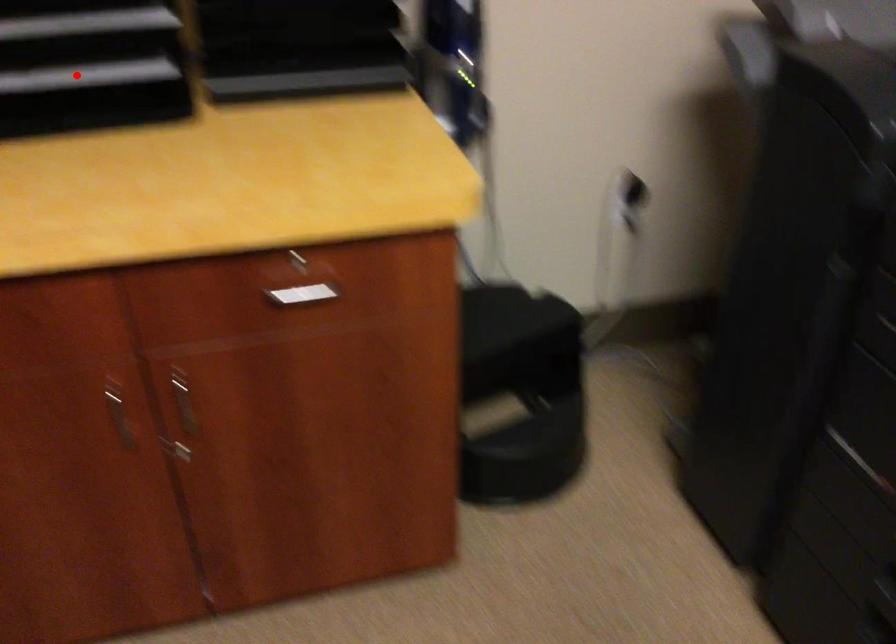
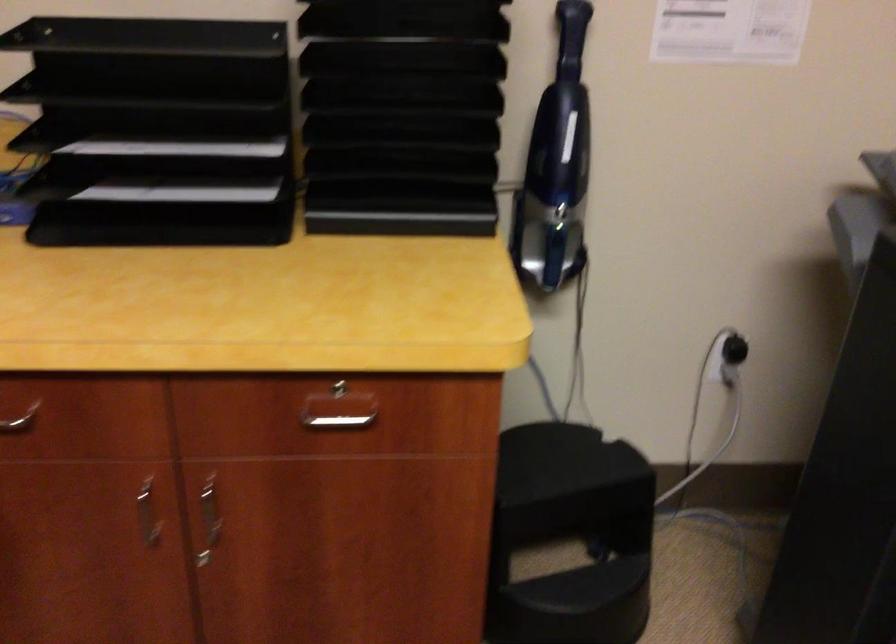
The point at the highlighted location is marked in the first image. Where is the corresponding point in the second image?

(183, 191)